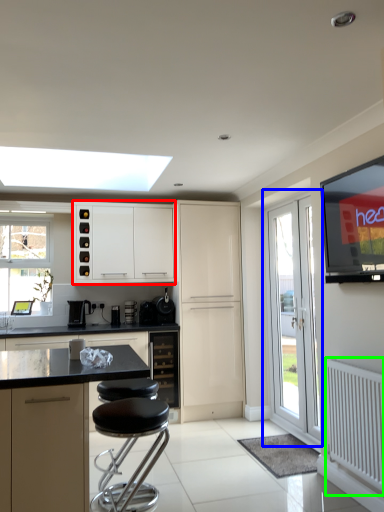
Question: Which is nearer to the cabinetry (highlighted by a red box)? door (highlighted by a blue box) or radiator (highlighted by a green box).

Choices:
 (A) door
 (B) radiator

Answer: (A)